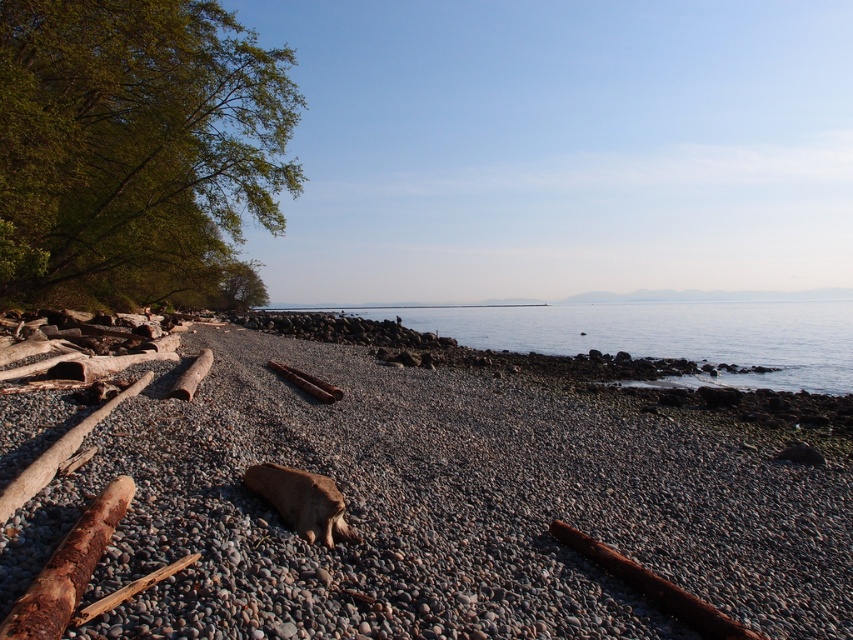
You are a geologist examining the coastal scene. You need to determine which of the two objects, the smooth pebbles at center or the clear water at center, has a smaller width in this image. Based on the scene description, which one is narrower?

The smooth pebbles at center is thinner than clear water at center, so the smooth pebbles at center has a smaller width.

Looking at this image, you are standing on the pebble beach and want to reach the clear water at center. Which direction should you move to get there?

The clear water at center is located at point coordinates 0.525 on the x axis and 0.781 on the y axis. Since you are on the pebble beach, you should move towards the direction of the clear water at center which is at the center of the image.

You are a child playing on the beach and want to pick up the smooth pebbles at center and the brown rough log at lower left. Which object is bigger in size?

The smooth pebbles at center has a larger size compared to the brown rough log at lower left.